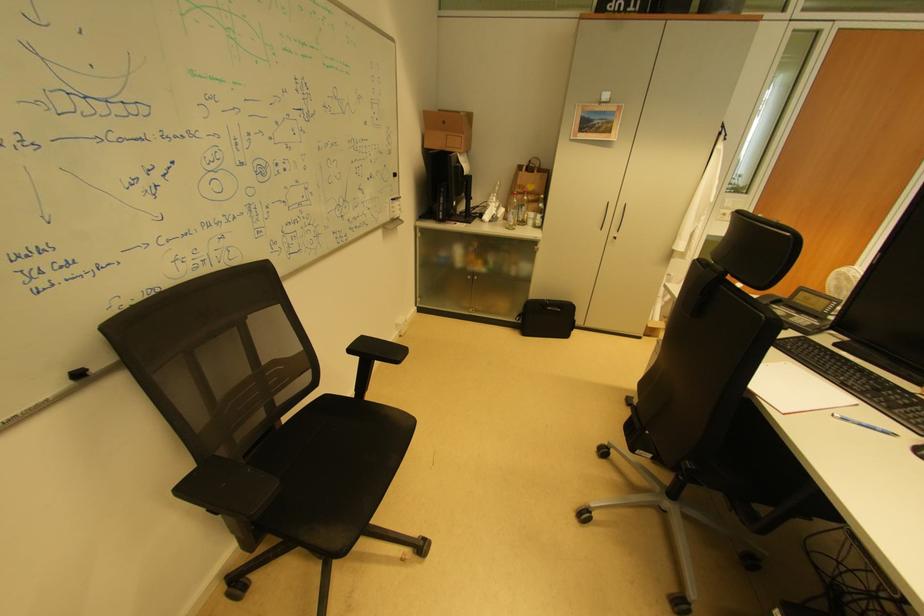
Find where to pull the cabinet door handle. Please return your answer as a coordinate pair (x, y).

(603, 216)